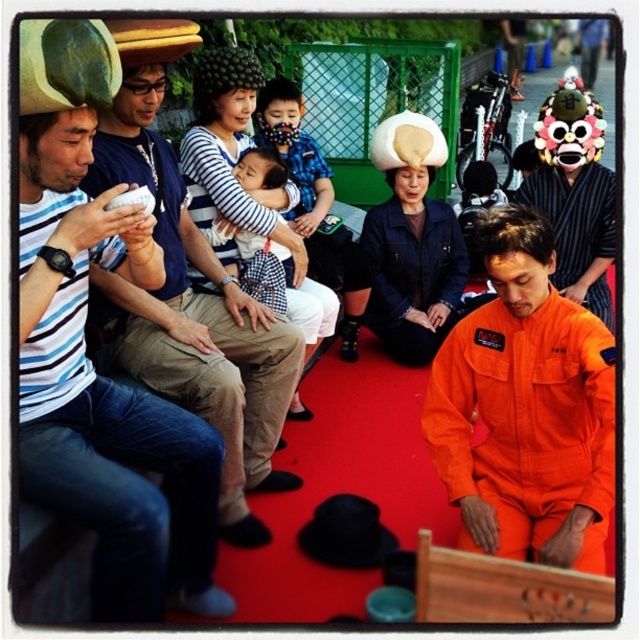
Does orange fabric jumpsuit at center appear on the right side of matte black phone at left?

Yes, orange fabric jumpsuit at center is to the right of matte black phone at left.

Who is more distant from viewer, (493, 317) or (122, 166)?

The point (493, 317) is more distant.

Identify the location of orange fabric jumpsuit at center. This screenshot has height=640, width=640. (525, 406).

This screenshot has height=640, width=640. In order to click on matte black phone at left in this screenshot , I will do `click(193, 316)`.

Can you confirm if matte black phone at left is smaller than checkered fabric shirt at center?

Incorrect, matte black phone at left is not smaller in size than checkered fabric shirt at center.

At what (x,y) coordinates should I click in order to perform the action: click on matte black phone at left. Please return your answer as a coordinate pair (x, y). The height and width of the screenshot is (640, 640). Looking at the image, I should click on (193, 316).

Is matte striped shirt at left positioned behind checkered fabric shirt at center?

No, matte striped shirt at left is closer to the viewer.

Is matte striped shirt at left closer to camera compared to checkered fabric shirt at center?

Yes, matte striped shirt at left is closer to the viewer.

Is point (141, 403) positioned before point (317, 195)?

Yes, point (141, 403) is closer to viewer.

Image resolution: width=640 pixels, height=640 pixels. What are the coordinates of `matte striped shirt at left` in the screenshot? It's located at (104, 392).